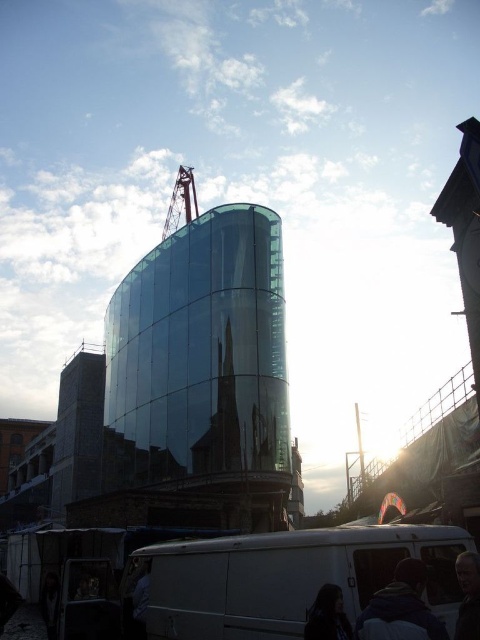
Question: Is transparent glass tower at center above dark hair at lower center?

Choices:
 (A) no
 (B) yes

Answer: (B)

Question: Among these objects, which one is nearest to the camera?

Choices:
 (A) dark hair at lower center
 (B) dark blue jacket at lower center
 (C) white matte van at lower center
 (D) red metal crane at upper center

Answer: (B)

Question: Where is transparent glass tower at upper center located in relation to dark brown leather jacket at lower right in the image?

Choices:
 (A) above
 (B) below

Answer: (A)

Question: Considering the real-world distances, which object is farthest from the red metal crane at upper center?

Choices:
 (A) transparent glass tower at center
 (B) metallic silver crane at center

Answer: (B)

Question: Is the position of transparent glass tower at center more distant than that of metallic silver crane at center?

Choices:
 (A) no
 (B) yes

Answer: (A)

Question: Which of the following is the farthest from the observer?

Choices:
 (A) (456, 628)
 (B) (355, 476)

Answer: (B)